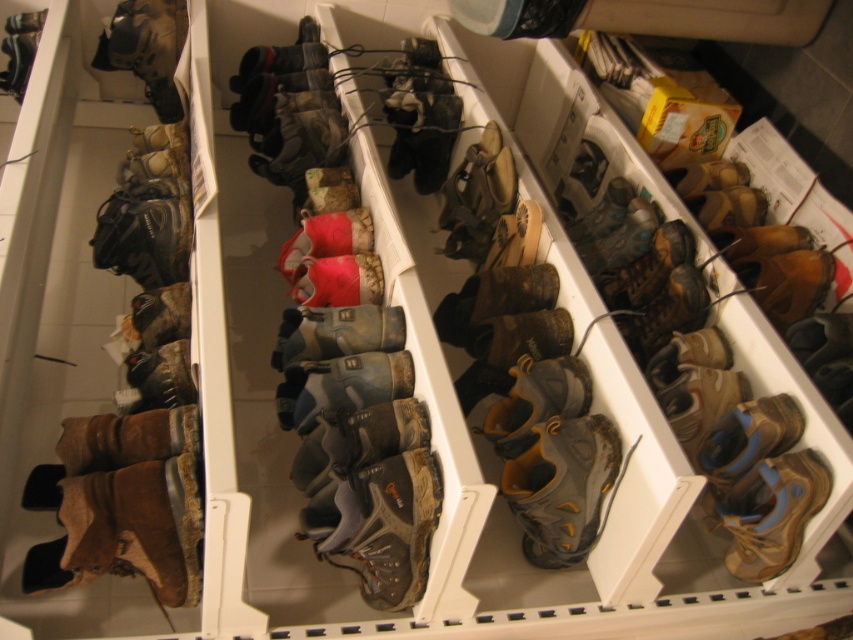
Who is more distant from viewer, (338, 476) or (762, 481)?

Point (762, 481)

Is brown suede boot at center thinner than tan suede boot at lower right?

No.

Locate an element on the screen. The width and height of the screenshot is (853, 640). brown suede boot at center is located at coordinates (345, 369).

Which is above, brown suede boots at left or tan suede boot at lower right?

Positioned higher is brown suede boots at left.

Who is taller, brown suede boots at left or tan suede boot at lower right?

With more height is brown suede boots at left.

The height and width of the screenshot is (640, 853). Identify the location of brown suede boots at left. (59, 305).

Which is behind, point (517, 461) or point (778, 532)?

The point (517, 461) is behind.

Is point (613, 461) behind point (726, 568)?

That is False.

You are a GUI agent. You are given a task and a screenshot of the screen. Output one action in this format:
    pyautogui.click(x=<x>, y=<y>)
    Task: Click on the gray suede boot at center
    The height and width of the screenshot is (640, 853).
    Given the screenshot: What is the action you would take?
    pyautogui.click(x=561, y=486)